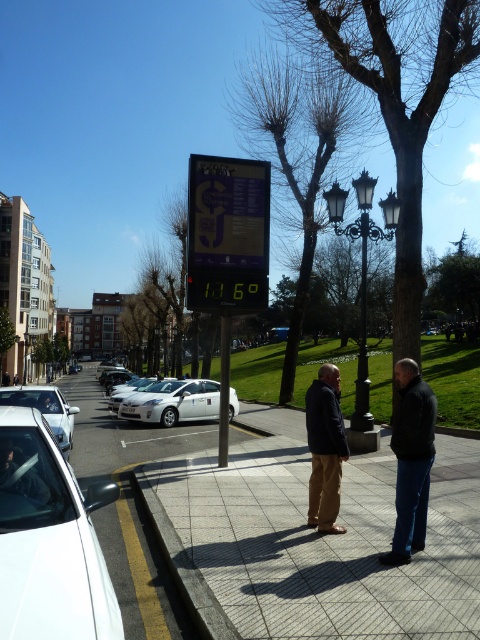
You are a delivery person trying to park your van on the street. You see the yellow concrete curb at lower left and the white glossy car at center. Which object is closer to the street level?

The white glossy car at center is closer to the street level because the yellow concrete curb at lower left is positioned above it.

You are standing on the sidewalk and want to read the black plastic sign at center. Can you see the sign clearly without moving your head?

The black plastic sign at center is located at point (228, 234), which is within your field of view, so yes, you can see the sign clearly without moving your head.